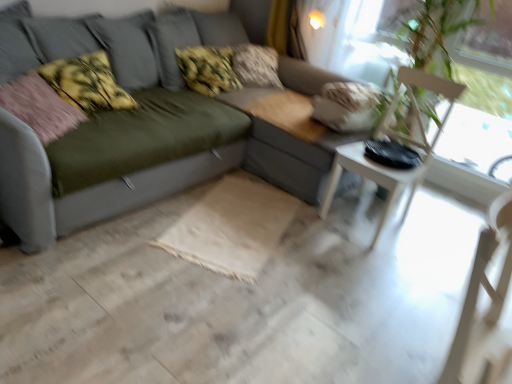
Locate an element on the screen. free spot below white wood chair at right, the 1th armchair positioned from the back (from a real-world perspective) is located at coordinates click(x=368, y=222).